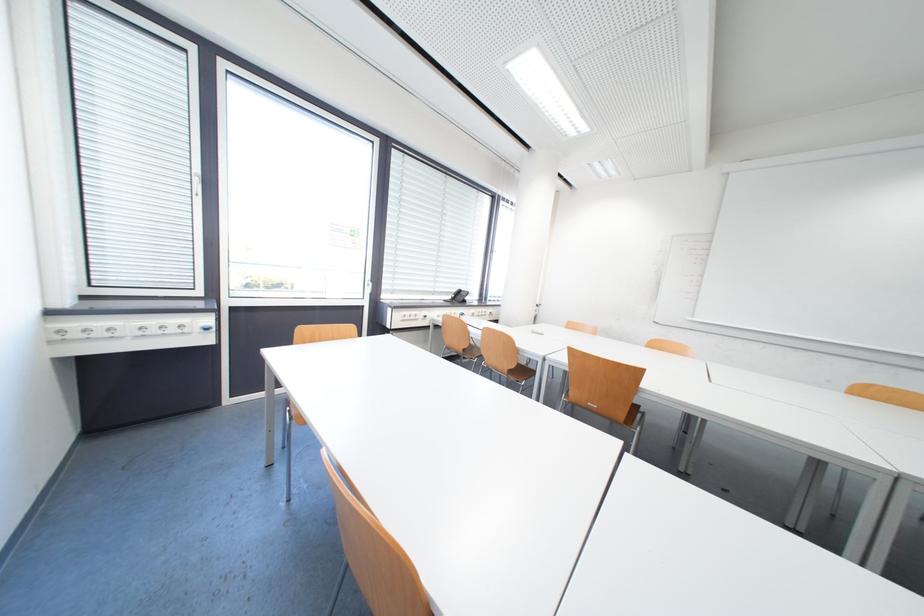
This screenshot has height=616, width=924. Describe the element at coordinates (457, 296) in the screenshot. I see `the telephone handset` at that location.